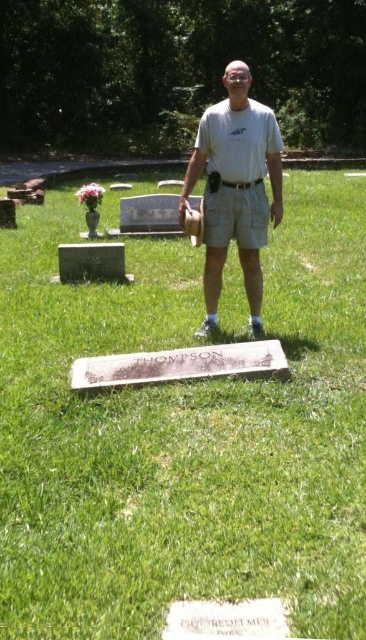
Between green grass at center and green marble gravestone at center, which one appears on the right side from the viewer's perspective?

green grass at center

The width and height of the screenshot is (366, 640). In order to click on green grass at center in this screenshot , I will do `click(184, 433)`.

Where is `green grass at center`? The height and width of the screenshot is (640, 366). green grass at center is located at coordinates (184, 433).

Where is `white cotton shirt at center`? This screenshot has height=640, width=366. white cotton shirt at center is located at coordinates (236, 188).

Between white cotton shirt at center and green marble gravestone at center, which one appears on the right side from the viewer's perspective?

white cotton shirt at center is more to the right.

Does point (274, 170) lie behind point (110, 269)?

No, (274, 170) is in front of (110, 269).

Where is `white cotton shirt at center`? Image resolution: width=366 pixels, height=640 pixels. white cotton shirt at center is located at coordinates (236, 188).

Does green grass at center appear on the right side of white cotton shirt at center?

In fact, green grass at center is to the left of white cotton shirt at center.

Is point (39, 362) positioned behind point (243, 268)?

No, it is not.

What do you see at coordinates (184, 433) in the screenshot? I see `green grass at center` at bounding box center [184, 433].

Locate an element on the screen. This screenshot has height=640, width=366. green grass at center is located at coordinates (184, 433).